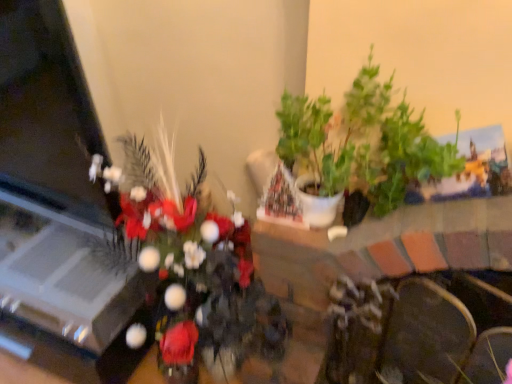
Question: Can you confirm if velvet dark brown armchair at lower right is smaller than green matte plant at upper right, the 1th houseplant from the right?

Choices:
 (A) yes
 (B) no

Answer: (A)

Question: Is velvet dark brown armchair at lower right facing away from green matte plant at upper right, the 1th houseplant from the right?

Choices:
 (A) no
 (B) yes

Answer: (A)

Question: Is velvet dark brown armchair at lower right to the right of green matte plant at upper right, marked as the 2th houseplant in a left-to-right arrangement, from the viewer's perspective?

Choices:
 (A) no
 (B) yes

Answer: (B)

Question: Does velvet dark brown armchair at lower right have a lesser width compared to green matte plant at upper right, the 1th houseplant from the right?

Choices:
 (A) yes
 (B) no

Answer: (A)

Question: Is velvet dark brown armchair at lower right positioned before green matte plant at upper right, the 1th houseplant from the right?

Choices:
 (A) no
 (B) yes

Answer: (A)

Question: In the image, is green matte plant at upper right, the 1th houseplant from the right, positioned in front of or behind green leafy plant at center, the first houseplant when ordered from left to right?

Choices:
 (A) behind
 (B) front

Answer: (A)

Question: Is point (340, 127) positioned closer to the camera than point (241, 329)?

Choices:
 (A) farther
 (B) closer

Answer: (A)

Question: Considering the positions of green matte plant at upper right, the 1th houseplant from the right, and green leafy plant at center, positioned as the second houseplant in right-to-left order, in the image, is green matte plant at upper right, the 1th houseplant from the right, bigger or smaller than green leafy plant at center, positioned as the second houseplant in right-to-left order,?

Choices:
 (A) small
 (B) big

Answer: (A)

Question: Looking at their shapes, would you say green matte plant at upper right, the 1th houseplant from the right, is wider or thinner than green leafy plant at center, positioned as the second houseplant in right-to-left order?

Choices:
 (A) wide
 (B) thin

Answer: (B)

Question: From the image's perspective, is green leafy plant at center, positioned as the second houseplant in right-to-left order, positioned above or below velvet dark brown armchair at lower right?

Choices:
 (A) below
 (B) above

Answer: (B)

Question: In terms of height, does green leafy plant at center, the first houseplant when ordered from left to right, look taller or shorter compared to velvet dark brown armchair at lower right?

Choices:
 (A) short
 (B) tall

Answer: (B)

Question: Looking at the image, does green leafy plant at center, positioned as the second houseplant in right-to-left order, seem bigger or smaller compared to velvet dark brown armchair at lower right?

Choices:
 (A) small
 (B) big

Answer: (B)

Question: Is green leafy plant at center, the first houseplant when ordered from left to right, wider or thinner than velvet dark brown armchair at lower right?

Choices:
 (A) wide
 (B) thin

Answer: (A)

Question: Is velvet dark brown armchair at lower right bigger or smaller than green leafy plant at center, positioned as the second houseplant in right-to-left order?

Choices:
 (A) small
 (B) big

Answer: (A)

Question: From their relative heights in the image, would you say velvet dark brown armchair at lower right is taller or shorter than green leafy plant at center, positioned as the second houseplant in right-to-left order?

Choices:
 (A) short
 (B) tall

Answer: (A)